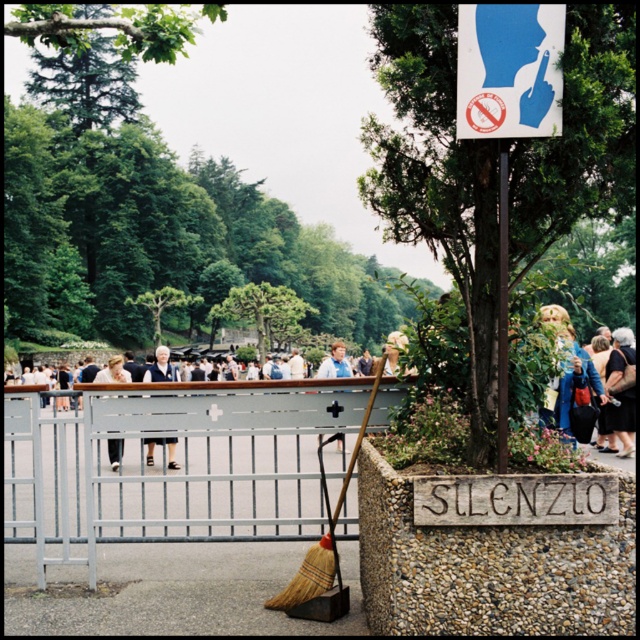
Question: Does black leather jacket at center appear on the right side of light brown leather jacket at center?

Choices:
 (A) no
 (B) yes

Answer: (B)

Question: Which point is closer to the camera?

Choices:
 (A) light blue shirt at center
 (B) dark blue fabric coat at center
 (C) brushed metal fence at center

Answer: (C)

Question: Among these objects, which one is nearest to the camera?

Choices:
 (A) golden textured hair at center
 (B) black leather jacket at center

Answer: (A)

Question: Based on their relative distances, which object is nearer to the blue plastic sign at upper center?

Choices:
 (A) black leather jacket at center
 (B) light brown leather jacket at center
 (C) light blue shirt at center
 (D) dark blue fabric coat at center

Answer: (D)

Question: Is brushed metal fence at center above black leather jacket at center?

Choices:
 (A) yes
 (B) no

Answer: (B)

Question: Can you confirm if black leather jacket at center is wider than dark blue fabric coat at center?

Choices:
 (A) yes
 (B) no

Answer: (B)